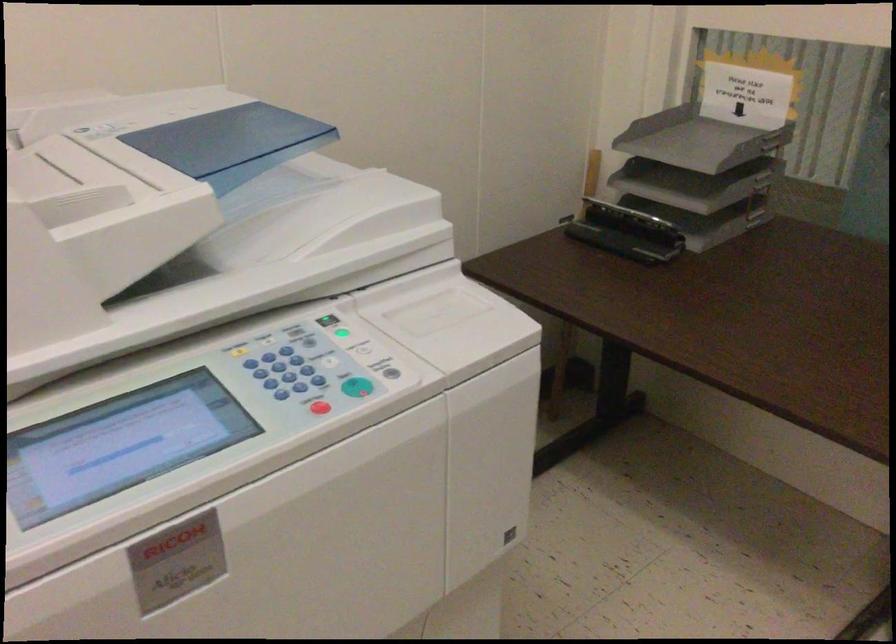
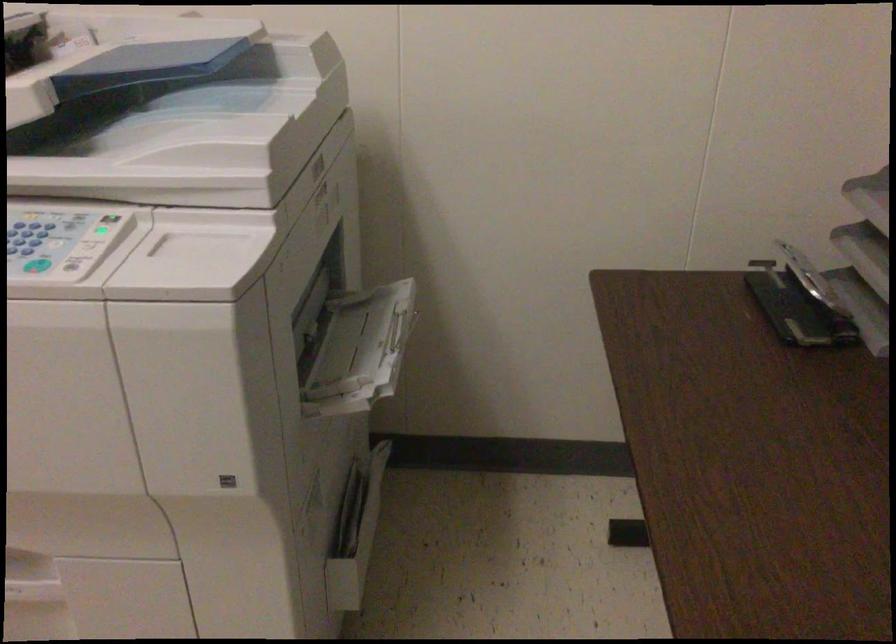
Locate, in the second image, the point that corresponds to (x=343, y=348) in the first image.

(92, 241)